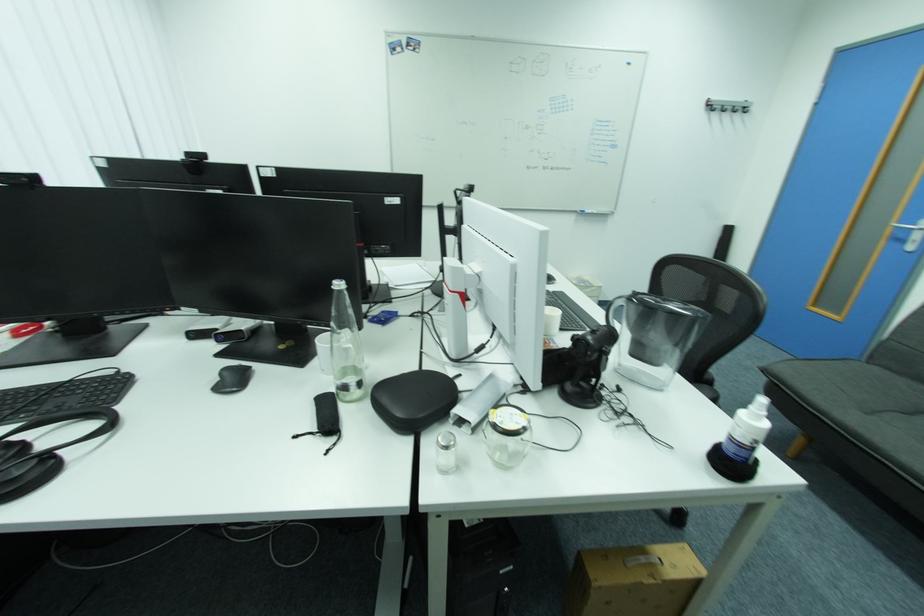
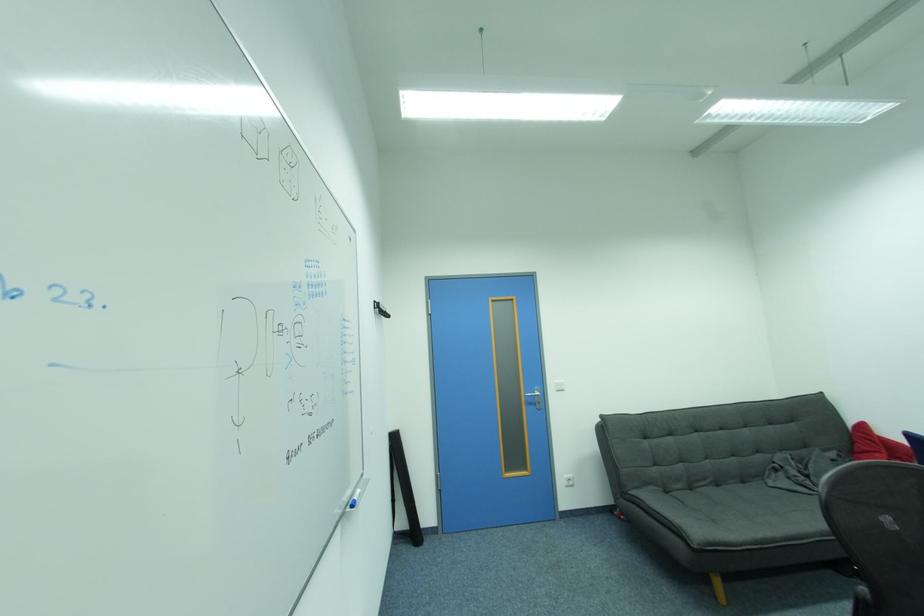
Question: I am providing you with two images of the same scene from different viewpoints. After the viewpoint changes to image2, which objects are now occluded?

Choices:
 (A) white light switch
 (B) silver door handle
 (C) dark chair armrest
 (D) silver wall hook

Answer: (D)